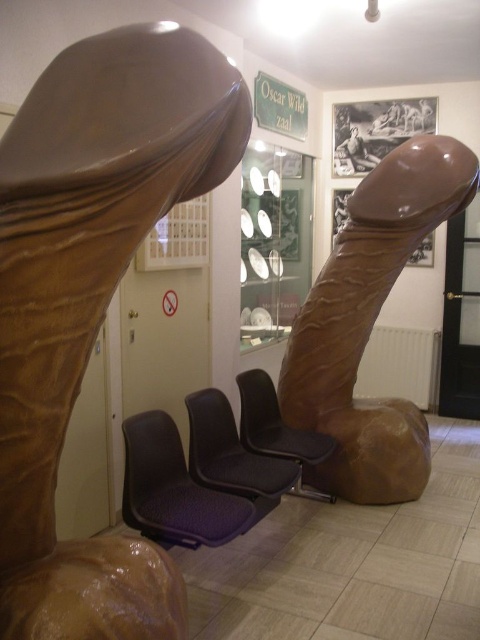
You are a visitor who wants to take a photo of the brown glossy sculpture at center without any obstructions. Since you are standing at the back of the room, will the purple fabric daybed at center block your view?

The brown glossy sculpture at center is taller than the purple fabric daybed at center, so it should not block your view as long as you are positioned where both objects are in line of sight.

You are a visitor at the museum and want to sit down. You see a purple fabric armchair at center and a matte black armchair at center. Which chair do you think is wider?

The purple fabric armchair at center might be wider than matte black armchair at center.